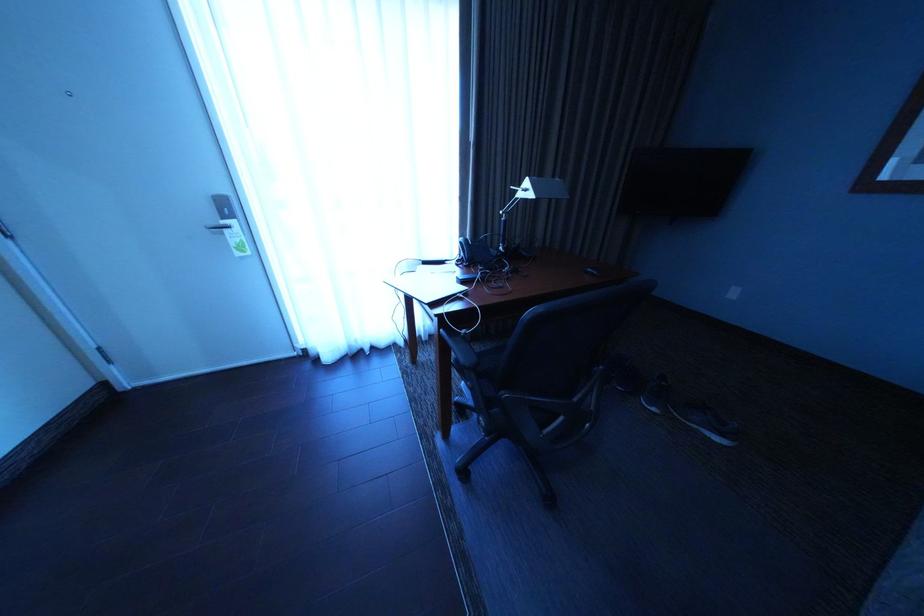
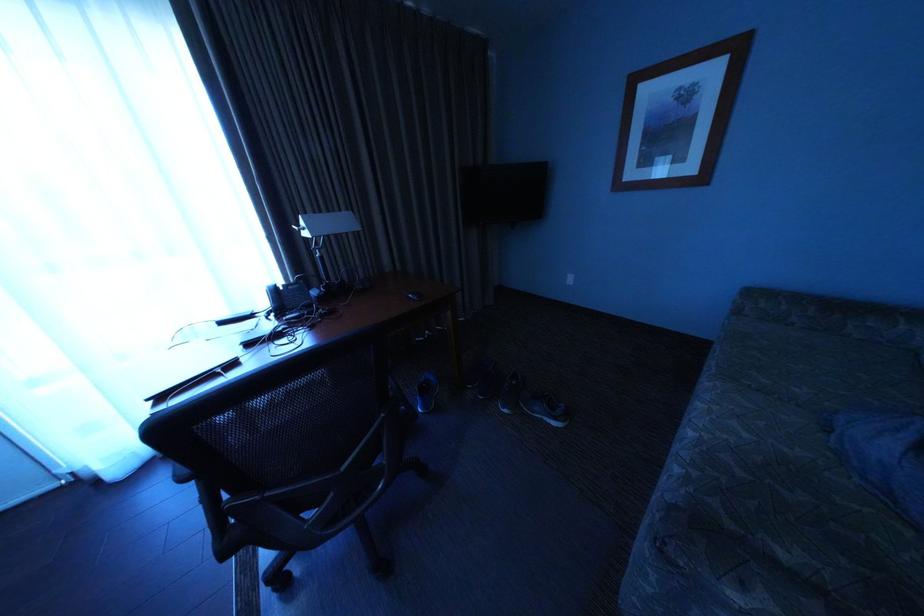
Question: How did the camera likely rotate?

Choices:
 (A) Left
 (B) Right
 (C) Up
 (D) Down

Answer: (B)